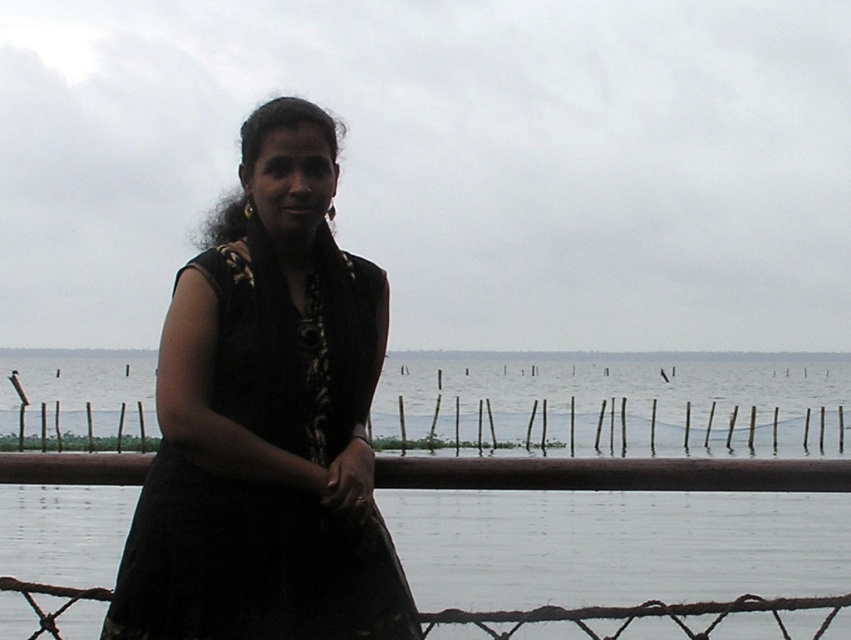
Question: Which point is farther to the camera?

Choices:
 (A) bamboo fence at center
 (B) black fabric dress at center

Answer: (A)

Question: Is transparent water at center wider than black fabric dress at center?

Choices:
 (A) no
 (B) yes

Answer: (B)

Question: Which point is farther to the camera?

Choices:
 (A) bamboo fence at center
 (B) black fabric dress at center
 (C) transparent water at center

Answer: (A)

Question: Which of the following is the farthest from the observer?

Choices:
 (A) transparent water at center
 (B) black fabric dress at center
 (C) bamboo fence at center

Answer: (C)

Question: Where is transparent water at center located in relation to bamboo fence at center in the image?

Choices:
 (A) right
 (B) left

Answer: (B)

Question: Does black fabric dress at center come in front of bamboo fence at center?

Choices:
 (A) no
 (B) yes

Answer: (B)